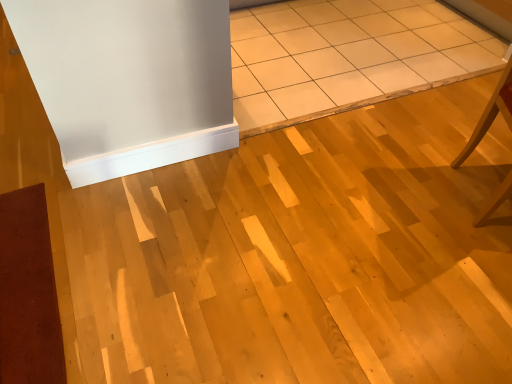
What are the coordinates of `free point below wooden chair leg at right (from a real-world perspective)` in the screenshot? It's located at (479, 187).